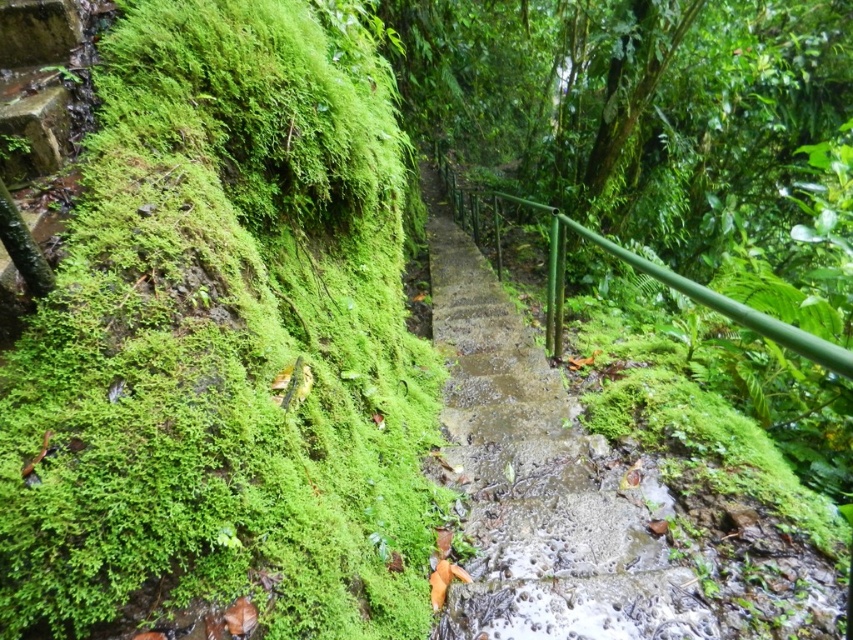
Is green concrete stairs at center thinner than green metal railing at center?

Indeed, green concrete stairs at center has a lesser width compared to green metal railing at center.

Which is behind, point (529, 333) or point (554, 340)?

Positioned behind is point (529, 333).

Does point (497, 317) lie in front of point (671, 284)?

No, (497, 317) is behind (671, 284).

Find the location of a particular element. The width and height of the screenshot is (853, 640). green concrete stairs at center is located at coordinates (538, 480).

Can you confirm if green mossy rock at left is thinner than green metal railing at center?

Correct, green mossy rock at left's width is less than green metal railing at center's.

Does green mossy rock at left have a lesser height compared to green metal railing at center?

Indeed, green mossy rock at left has a lesser height compared to green metal railing at center.

Where is `green mossy rock at left`? The width and height of the screenshot is (853, 640). green mossy rock at left is located at coordinates (225, 344).

Is green mossy rock at left taller than green concrete stairs at center?

Yes.

Does green mossy rock at left have a lesser height compared to green concrete stairs at center?

No, green mossy rock at left is not shorter than green concrete stairs at center.

Locate an element on the screen. This screenshot has height=640, width=853. green mossy rock at left is located at coordinates (225, 344).